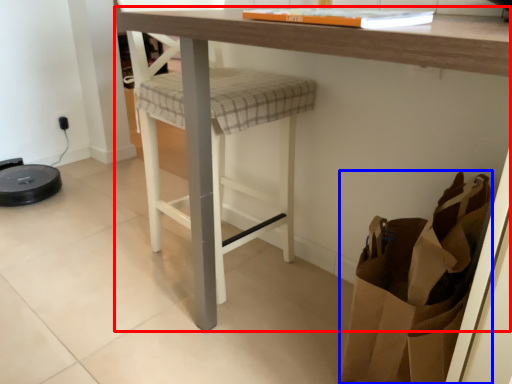
Question: Which object is further to the camera taking this photo, table (highlighted by a red box) or shopping bag (highlighted by a blue box)?

Choices:
 (A) table
 (B) shopping bag

Answer: (B)